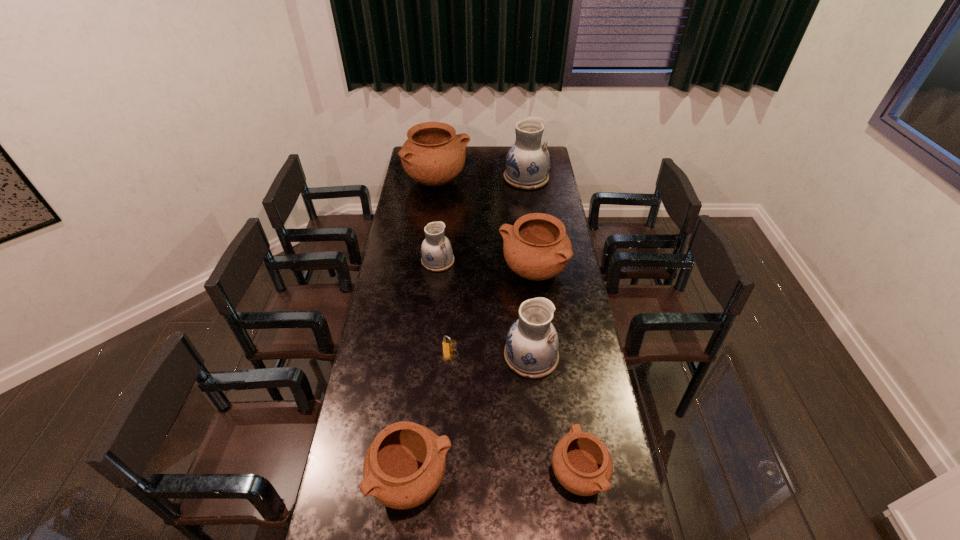
Where is `the shortest object`? the shortest object is located at coordinates (449, 344).

I want to click on free space located on the front of the farthest blue pottery, so click(x=530, y=210).

Identify the location of vacant area situated 0.280m on the right of the farthest terracotta pottery. (519, 181).

You are a GUI agent. You are given a task and a screenshot of the screen. Output one action in this format:
    pyautogui.click(x=<x>, y=<y>)
    Task: Click on the free space located 0.160m on the back of the second smallest blue pottery
    Image resolution: width=960 pixels, height=540 pixels.
    Given the screenshot: What is the action you would take?
    pyautogui.click(x=526, y=303)

You are a GUI agent. You are given a task and a screenshot of the screen. Output one action in this format:
    pyautogui.click(x=<x>, y=<y>)
    Task: Click on the vacant space located 0.110m on the front of the third smallest terracotta pottery
    This screenshot has width=960, height=540.
    Given the screenshot: What is the action you would take?
    tap(538, 314)

Locate an element on the screen. Image resolution: width=960 pixels, height=540 pixels. vacant space located 0.120m on the right of the leftmost blue pottery is located at coordinates (480, 260).

Where is `blank area located 0.050m on the back of the second smallest terracotta pottery`? blank area located 0.050m on the back of the second smallest terracotta pottery is located at coordinates (418, 428).

Find the location of a particular element. vacant area located 0.390m on the left of the smallest terracotta pottery is located at coordinates [425, 472].

Image resolution: width=960 pixels, height=540 pixels. In order to click on vacant space located 0.100m on the side with the combination dials of the shortest object in this screenshot , I will do `click(448, 376)`.

Image resolution: width=960 pixels, height=540 pixels. I want to click on object situated at the far left corner, so click(433, 155).